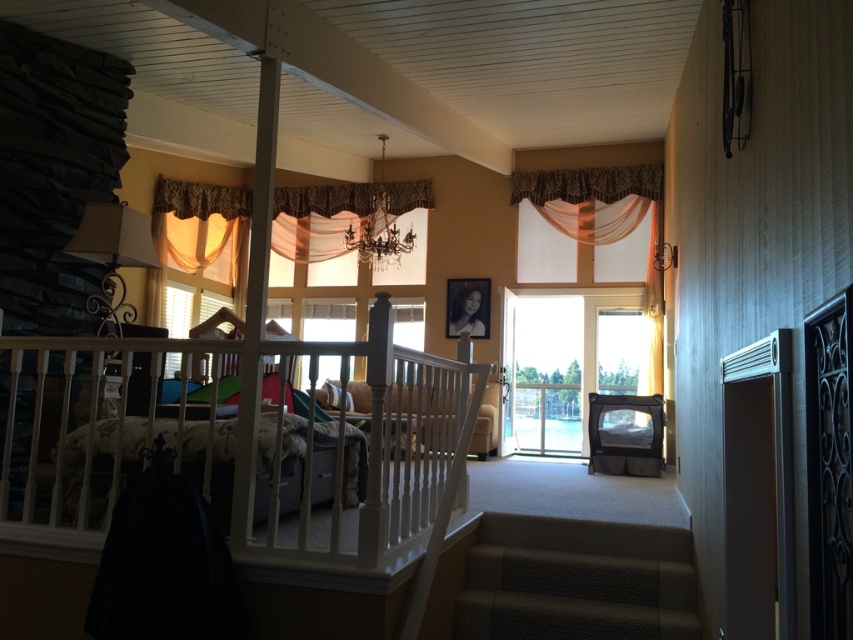
You are standing at the top of the carpeted stairs at lower center and want to move to the sheer orange fabric at upper left. Considering the space each occupies, which object do you think you will reach first?

The carpeted stairs at lower center occupies less space than the sheer orange fabric at upper left, so you will reach the carpeted stairs at lower center first since it is closer to your current position.

You are standing at the top of the carpeted stairs at lower center and want to exit through the clear glass door at center. Can you walk straight ahead to reach the door without needing to turn?

The carpeted stairs at lower center is positioned under clear glass door at center, so yes, you can walk straight ahead to reach the door without needing to turn.